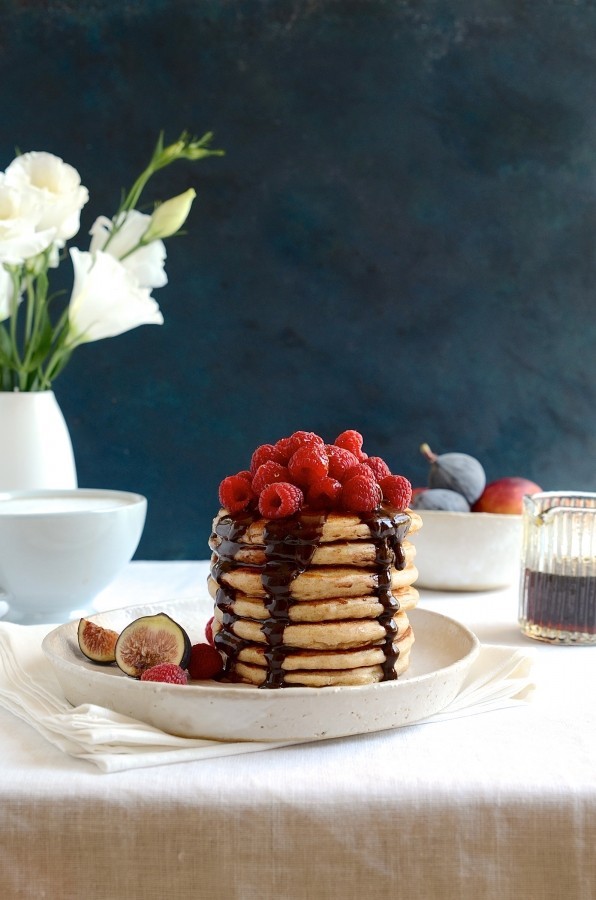
Locate an element on the screen. This screenshot has height=900, width=596. glass pourer is located at coordinates (583, 510).